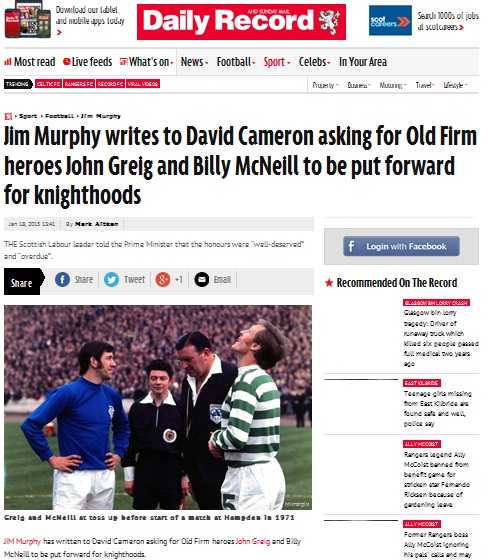
Locate an element on the screen. The height and width of the screenshot is (560, 490). newspaper is located at coordinates (x=428, y=318).